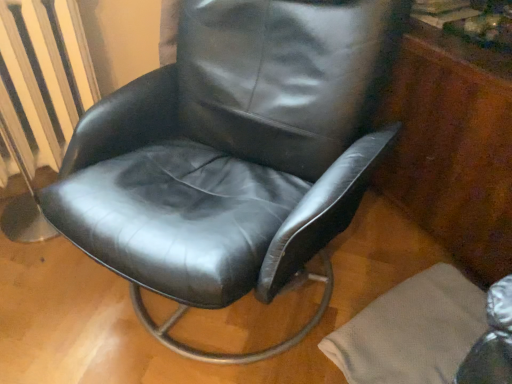
The height and width of the screenshot is (384, 512). Identify the location of mahogany wood dresser at right. (453, 147).

What is the approximate width of metallic silver radiator at left?

metallic silver radiator at left is 20.85 centimeters in width.

In order to face metallic silver radiator at left, should I rotate leftwards or rightwards?

Rotate left and turn 27.527 degrees.

Image resolution: width=512 pixels, height=384 pixels. What are the coordinates of `mahogany wood dresser at right` in the screenshot? It's located at (453, 147).

The width and height of the screenshot is (512, 384). Find the location of `chair that is below the metallic silver radiator at left (from the image's perspective)`. chair that is below the metallic silver radiator at left (from the image's perspective) is located at coordinates (233, 154).

Does point (217, 24) come behind point (41, 113)?

No, (217, 24) is in front of (41, 113).

From the image's perspective, between black leather chair at center and metallic silver radiator at left, which one is located above?

From the image's view, metallic silver radiator at left is above.

From the image's perspective, who appears lower, mahogany wood dresser at right or black leather chair at center?

From the image's view, black leather chair at center is below.

Is mahogany wood dresser at right positioned with its back to black leather chair at center?

No, mahogany wood dresser at right is not facing the opposite direction of black leather chair at center.

Can you confirm if mahogany wood dresser at right is positioned to the left of black leather chair at center?

No.

Is mahogany wood dresser at right positioned far away from black leather chair at center?

No, there isn't a large distance between mahogany wood dresser at right and black leather chair at center.

From the image's perspective, which one is positioned higher, mahogany wood dresser at right or metallic silver radiator at left?

From the image's view, metallic silver radiator at left is above.

Is mahogany wood dresser at right completely or partially outside of metallic silver radiator at left?

Yes, mahogany wood dresser at right is not within metallic silver radiator at left.

Is mahogany wood dresser at right placed right next to metallic silver radiator at left?

They are not placed beside each other.

Find the location of a particular element. This screenshot has width=512, height=384. dresser lying below the metallic silver radiator at left (from the image's perspective) is located at coordinates (453, 147).

This screenshot has width=512, height=384. In the image, there is a metallic silver radiator at left. Find the location of `dresser below it (from a real-world perspective)`. dresser below it (from a real-world perspective) is located at coordinates (453, 147).

Is metallic silver radiator at left thinner than mahogany wood dresser at right?

Yes.

Based on the photo, is metallic silver radiator at left shorter than mahogany wood dresser at right?

Correct, metallic silver radiator at left is not as tall as mahogany wood dresser at right.

Does metallic silver radiator at left have a lesser width compared to black leather chair at center?

Yes, metallic silver radiator at left is thinner than black leather chair at center.

Does metallic silver radiator at left have a greater height compared to black leather chair at center?

In fact, metallic silver radiator at left may be shorter than black leather chair at center.

Who is bigger, metallic silver radiator at left or black leather chair at center?

black leather chair at center is bigger.

Is black leather chair at center oriented towards mahogany wood dresser at right?

No, black leather chair at center is not aimed at mahogany wood dresser at right.

Consider the image. Considering the relative sizes of black leather chair at center and mahogany wood dresser at right in the image provided, is black leather chair at center thinner than mahogany wood dresser at right?

No.

Is black leather chair at center next to mahogany wood dresser at right?

No, black leather chair at center is not beside mahogany wood dresser at right.

Locate an element on the screen. dresser above the black leather chair at center (from the image's perspective) is located at coordinates (453, 147).

The image size is (512, 384). Identify the location of radiator that is under the black leather chair at center (from a real-world perspective). (27, 88).

This screenshot has height=384, width=512. In order to click on dresser on the right of black leather chair at center in this screenshot , I will do `click(453, 147)`.

In the scene shown: From the image, which object appears to be nearer to mahogany wood dresser at right, black leather chair at center or metallic silver radiator at left?

black leather chair at center lies closer to mahogany wood dresser at right than the other object.

Looking at the image, which one is located further to metallic silver radiator at left, black leather chair at center or mahogany wood dresser at right?

mahogany wood dresser at right is further to metallic silver radiator at left.

Based on their spatial positions, is metallic silver radiator at left or black leather chair at center further from mahogany wood dresser at right?

Among the two, metallic silver radiator at left is located further to mahogany wood dresser at right.

From the image, which object appears to be farther from metallic silver radiator at left, mahogany wood dresser at right or black leather chair at center?

Among the two, mahogany wood dresser at right is located further to metallic silver radiator at left.

From the image, which object appears to be nearer to black leather chair at center, metallic silver radiator at left or mahogany wood dresser at right?

Based on the image, metallic silver radiator at left appears to be nearer to black leather chair at center.

Looking at the image, which one is located closer to black leather chair at center, mahogany wood dresser at right or metallic silver radiator at left?

Among the two, metallic silver radiator at left is located nearer to black leather chair at center.

Where is `chair between metallic silver radiator at left and mahogany wood dresser at right`? This screenshot has height=384, width=512. chair between metallic silver radiator at left and mahogany wood dresser at right is located at coordinates (233, 154).